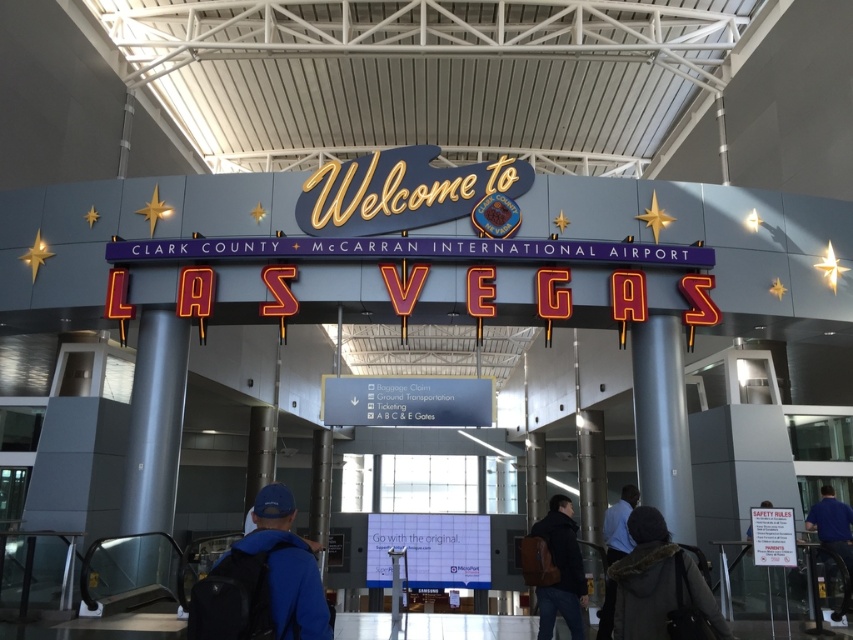
You are an airport employee carrying a dark blue jacket at lower right. You need to place it on a rack that can only hold items narrower than the metallic gray pillar at center. Will the jacket fit?

The metallic gray pillar at center is wider than the dark blue jacket at lower right, so the jacket will fit on the rack since it is narrower than the pillar.

You are standing at the entrance of McCarran International Airport and notice two shirts in the crowd. Which shirt, the blue fabric shirt at right or the light blue shirt at center, is closer to you?

The blue fabric shirt at right is closer to you because it is further to the viewer than the light blue shirt at center.

You are standing at the entrance of McCarran International Airport and see a blue fabric shirt at right and a light blue shirt at center. If you want to place a 3 feet wide luggage cart between them, will there be enough space?

The blue fabric shirt at right and light blue shirt at center are 9.30 feet apart, so yes, the luggage cart can fit between them since the distance is greater than the cart width.